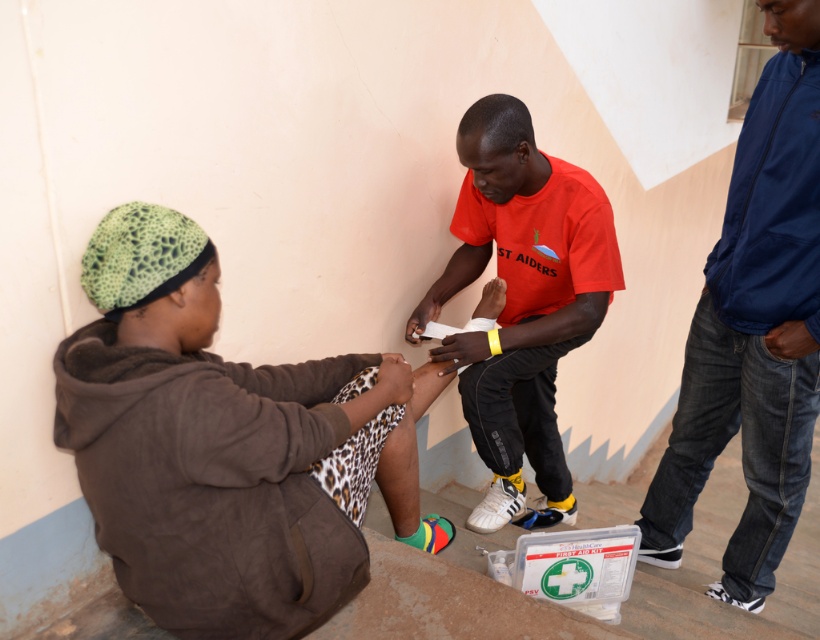
Question: Which of the following is the closest to the observer?

Choices:
 (A) blue jeans at right
 (B) red matte t-shirt at center
 (C) brown suede hoodie at lower left

Answer: (C)

Question: Does blue jeans at right have a smaller size compared to red matte t-shirt at center?

Choices:
 (A) yes
 (B) no

Answer: (A)

Question: Is brown suede hoodie at lower left to the left of blue jeans at right from the viewer's perspective?

Choices:
 (A) no
 (B) yes

Answer: (B)

Question: Which object is closer to the camera taking this photo?

Choices:
 (A) red matte t-shirt at center
 (B) blue jeans at right

Answer: (B)

Question: Which object is farther from the camera taking this photo?

Choices:
 (A) red matte t-shirt at center
 (B) blue jeans at right

Answer: (A)

Question: Can you confirm if blue jeans at right is positioned to the left of red matte t-shirt at center?

Choices:
 (A) yes
 (B) no

Answer: (B)